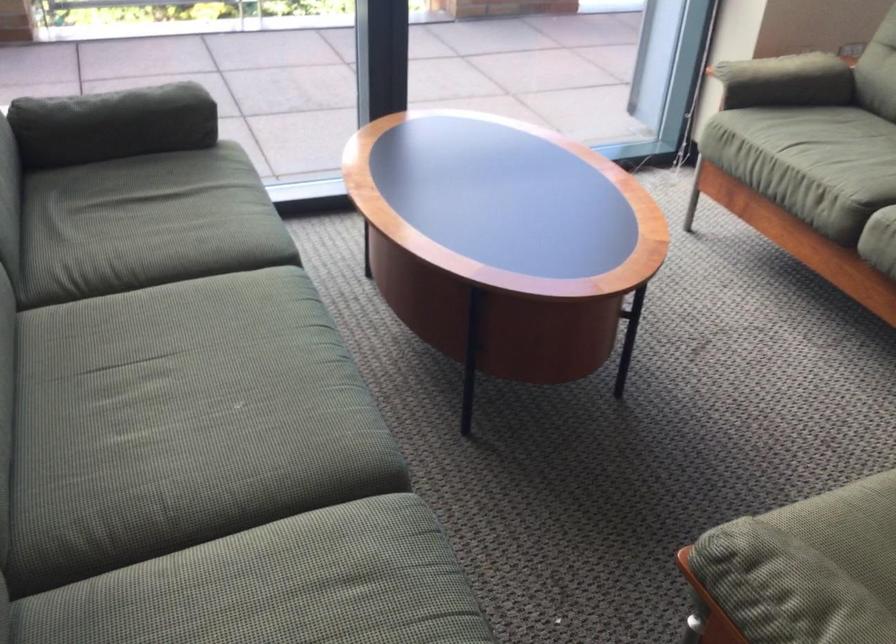
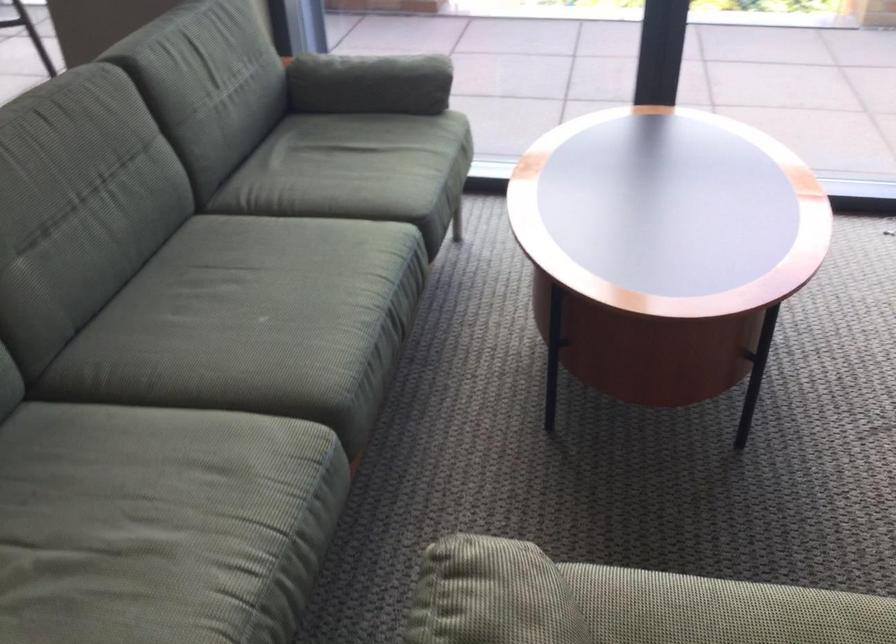
Question: The camera is either moving clockwise (left) or counter-clockwise (right) around the object. The first image is from the beginning of the video and the second image is from the end. Is the camera moving left or right when shooting the video?

Choices:
 (A) Left
 (B) Right

Answer: (B)